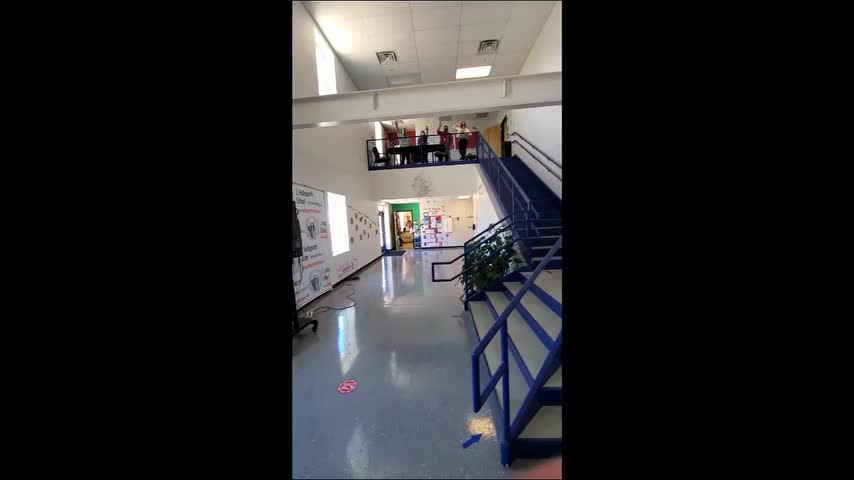
Find the location of `light reflecting off the floor`. light reflecting off the floor is located at coordinates (349, 335), (393, 371), (361, 459), (477, 428), (388, 273).